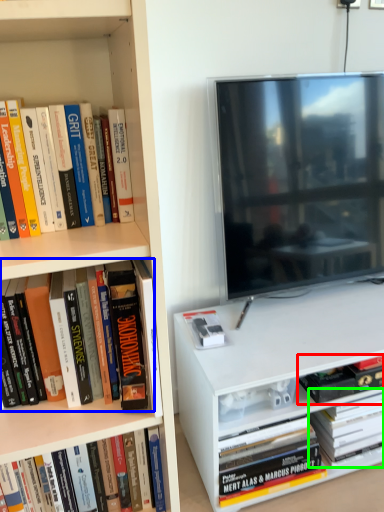
Question: Which is farther away from book (highlighted by a red box)? book (highlighted by a blue box) or book (highlighted by a green box)?

Choices:
 (A) book
 (B) book

Answer: (A)